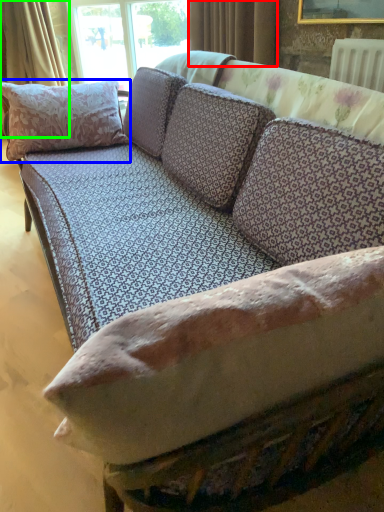
Question: Estimate the real-world distances between objects in this image. Which object is farther from curtain (highlighted by a red box), pillow (highlighted by a blue box) or curtain (highlighted by a green box)?

Choices:
 (A) pillow
 (B) curtain

Answer: (B)